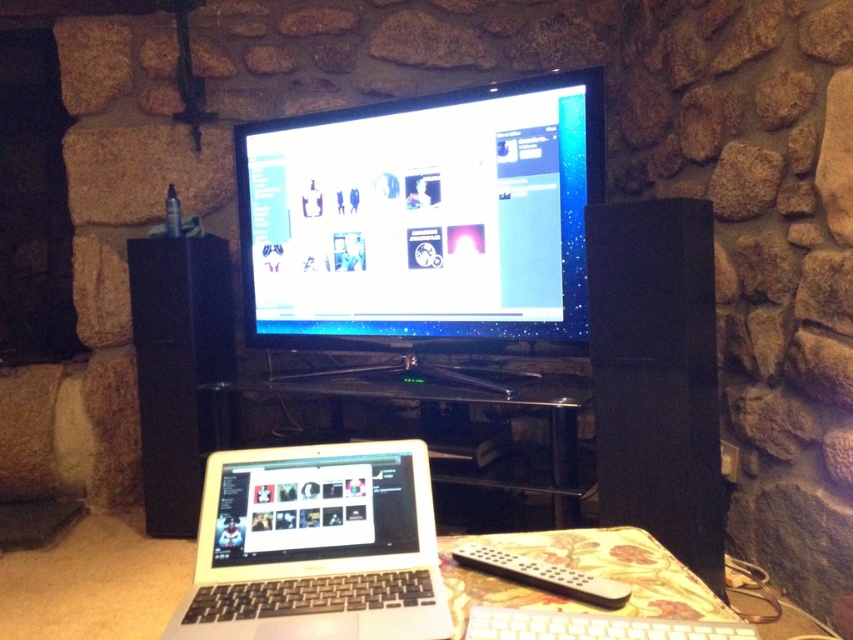
Can you confirm if matte black monitor at center is positioned above silver/black plastic laptop at lower center?

Indeed, matte black monitor at center is positioned over silver/black plastic laptop at lower center.

Is matte black monitor at center to the right of silver/black plastic laptop at lower center from the viewer's perspective?

Indeed, matte black monitor at center is positioned on the right side of silver/black plastic laptop at lower center.

Between point (511, 180) and point (247, 548), which one is positioned in front?

Positioned in front is point (247, 548).

The height and width of the screenshot is (640, 853). Identify the location of matte black monitor at center. (422, 220).

Between point (409, 316) and point (405, 400), which one is positioned behind?

Positioned behind is point (409, 316).

Is point (363, 243) positioned before point (590, 486)?

No.

Where is `matte black monitor at center`? The height and width of the screenshot is (640, 853). matte black monitor at center is located at coordinates (422, 220).

How much distance is there between matte black monitor at center and white plastic keyboard at lower center?

matte black monitor at center is 1.55 meters from white plastic keyboard at lower center.

I want to click on matte black monitor at center, so click(422, 220).